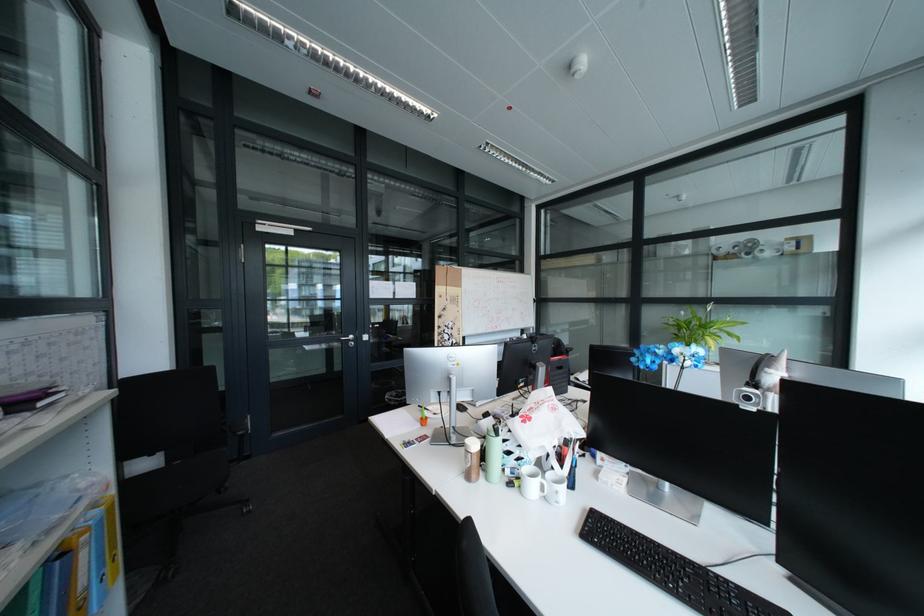
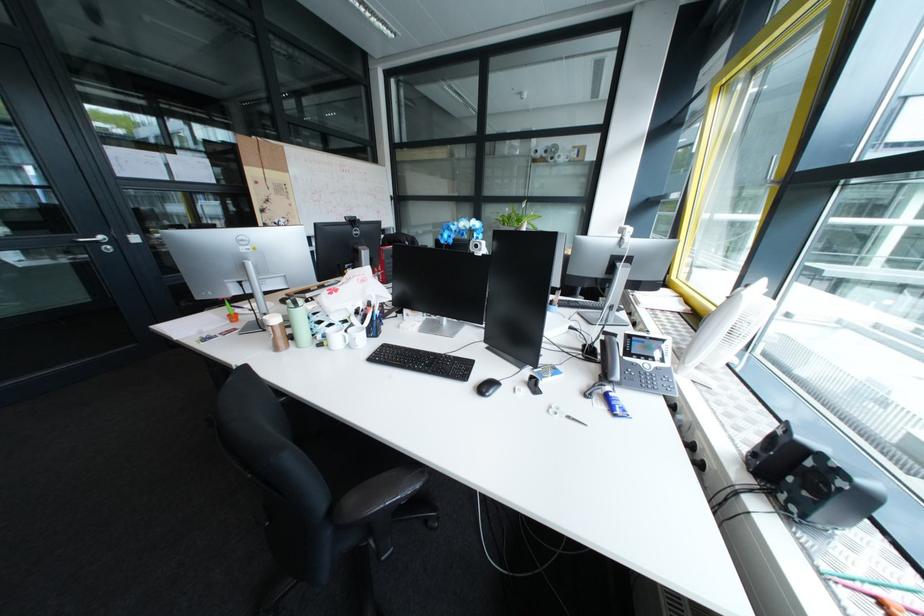
The point at (361, 338) is marked in the first image. Where is the corresponding point in the second image?

(107, 238)